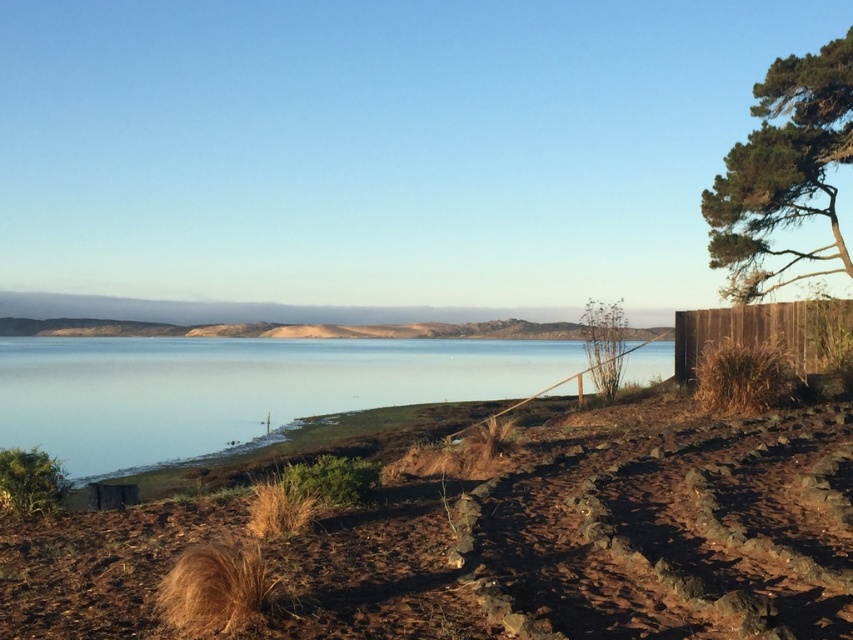
How far apart are brown soil at lower right and brown wooden fence at right?

The distance of brown soil at lower right from brown wooden fence at right is 8.11 meters.

Between point (682, 481) and point (685, 333), which one is positioned behind?

Point (685, 333)

In order to click on brown soil at lower right in this screenshot , I will do `click(592, 536)`.

The width and height of the screenshot is (853, 640). What do you see at coordinates (592, 536) in the screenshot? I see `brown soil at lower right` at bounding box center [592, 536].

Consider the image. Is brown soil at lower right in front of clear water at center?

That is True.

Describe the element at coordinates (592, 536) in the screenshot. I see `brown soil at lower right` at that location.

I want to click on brown soil at lower right, so click(592, 536).

Who is positioned more to the left, clear water at center or green textured tree at upper right?

From the viewer's perspective, clear water at center appears more on the left side.

Who is more forward, (218, 387) or (775, 106)?

Point (775, 106)

The image size is (853, 640). In order to click on clear water at center in this screenshot , I will do `click(236, 388)`.